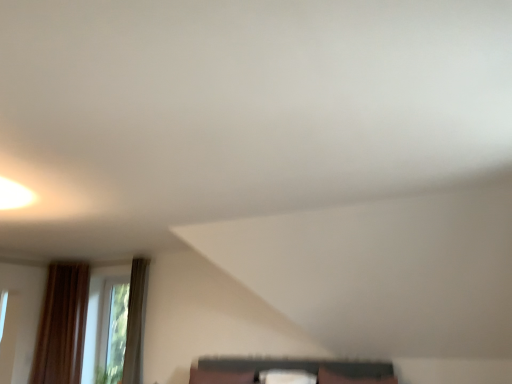
Question: From the image's perspective, is white fabric pillow at center, the 2th pillow positioned from the left, over matte black shelf at lower center?

Choices:
 (A) no
 (B) yes

Answer: (A)

Question: Can you confirm if white fabric pillow at center, the 1th pillow in the right-to-left sequence, is taller than matte black shelf at lower center?

Choices:
 (A) no
 (B) yes

Answer: (A)

Question: Is white fabric pillow at center, the 1th pillow in the right-to-left sequence, closer to the viewer compared to matte black shelf at lower center?

Choices:
 (A) yes
 (B) no

Answer: (B)

Question: Does white fabric pillow at center, the 1th pillow in the right-to-left sequence, appear on the left side of matte black shelf at lower center?

Choices:
 (A) yes
 (B) no

Answer: (A)

Question: Can you confirm if white fabric pillow at center, the 1th pillow in the right-to-left sequence, is positioned to the right of matte black shelf at lower center?

Choices:
 (A) yes
 (B) no

Answer: (B)

Question: Is transparent glass window at lower left wider or thinner than white fabric pillow at center, the 1th pillow in the right-to-left sequence?

Choices:
 (A) thin
 (B) wide

Answer: (A)

Question: Considering their positions, is transparent glass window at lower left located in front of or behind white fabric pillow at center, the 2th pillow positioned from the left?

Choices:
 (A) behind
 (B) front

Answer: (A)

Question: Looking at the image, does transparent glass window at lower left seem bigger or smaller compared to white fabric pillow at center, the 2th pillow positioned from the left?

Choices:
 (A) big
 (B) small

Answer: (A)

Question: From the image's perspective, is transparent glass window at lower left positioned above or below white fabric pillow at center, the 1th pillow in the right-to-left sequence?

Choices:
 (A) above
 (B) below

Answer: (B)

Question: In the image, is transparent glass window at lower left positioned in front of or behind brown fabric pillow at lower center, acting as the 2th pillow starting from the right?

Choices:
 (A) behind
 (B) front

Answer: (A)

Question: Considering the relative positions of transparent glass window at lower left and brown fabric pillow at lower center, which ranks as the 1th pillow in left-to-right order, in the image provided, is transparent glass window at lower left to the left or to the right of brown fabric pillow at lower center, which ranks as the 1th pillow in left-to-right order,?

Choices:
 (A) right
 (B) left

Answer: (B)

Question: From the image's perspective, is transparent glass window at lower left positioned above or below brown fabric pillow at lower center, acting as the 2th pillow starting from the right?

Choices:
 (A) above
 (B) below

Answer: (A)

Question: From a real-world perspective, is transparent glass window at lower left positioned above or below brown fabric pillow at lower center, which ranks as the 1th pillow in left-to-right order?

Choices:
 (A) above
 (B) below

Answer: (A)

Question: Is white fabric pillow at center, the 1th pillow in the right-to-left sequence, situated inside transparent glass window at lower left or outside?

Choices:
 (A) outside
 (B) inside

Answer: (A)

Question: In terms of height, does white fabric pillow at center, the 1th pillow in the right-to-left sequence, look taller or shorter compared to transparent glass window at lower left?

Choices:
 (A) tall
 (B) short

Answer: (B)